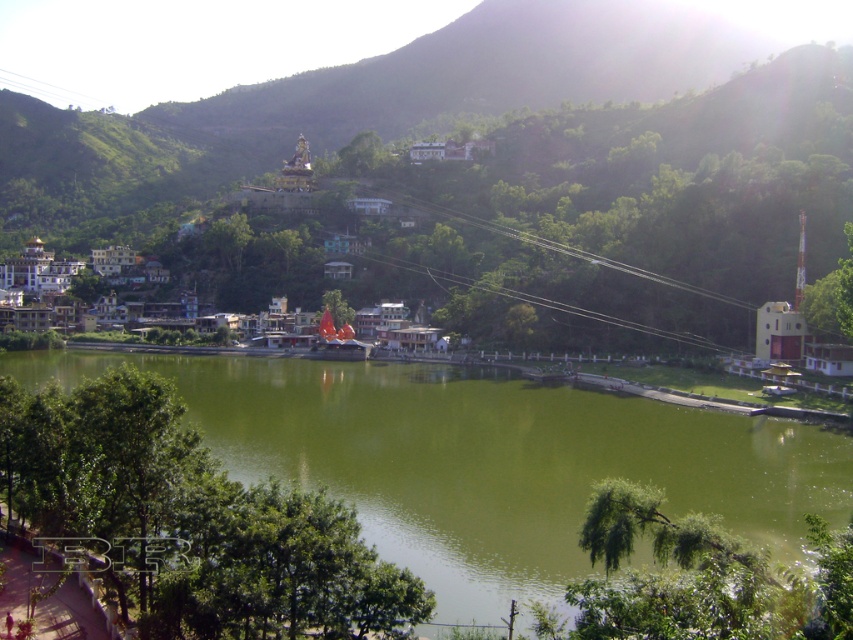
Based on the photo, you are a photographer planning to capture the green water at center and the white stucco buildings at center in a single shot. Based on their heights, which one should you focus on first to ensure both are in frame?

The green water at center is not as tall as the white stucco buildings at center, so you should focus on the white stucco buildings at center first to ensure both are in frame.